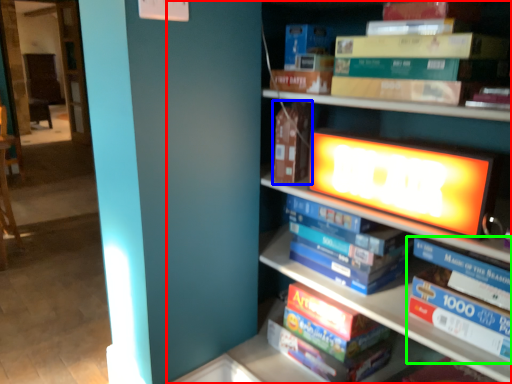
Question: Which object is positioned farthest from bookcase (highlighted by a red box)? Select from paperback book (highlighted by a blue box) and book (highlighted by a green box).

Choices:
 (A) paperback book
 (B) book

Answer: (B)